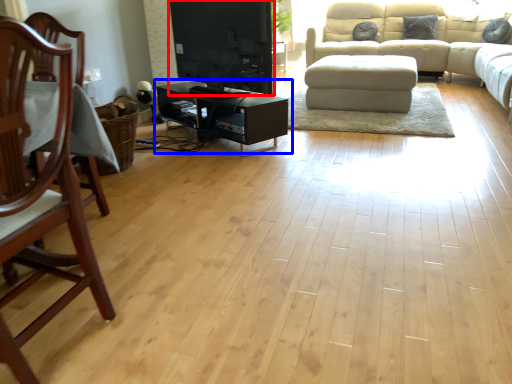
Question: Which object appears closest to the camera in this image, entertainment center (highlighted by a red box) or table (highlighted by a blue box)?

Choices:
 (A) entertainment center
 (B) table

Answer: (A)